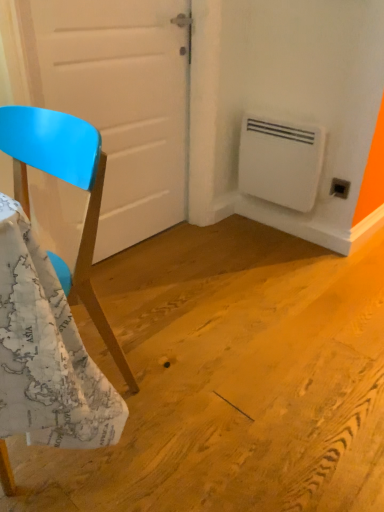
Question: Is matte blue chair at left wider or thinner than white plastic air conditioning unit at lower right?

Choices:
 (A) wide
 (B) thin

Answer: (A)

Question: From a real-world perspective, is matte blue chair at left positioned above or below white plastic air conditioning unit at lower right?

Choices:
 (A) above
 (B) below

Answer: (A)

Question: Which of these objects is positioned closest to the white plastic air conditioning unit at lower right?

Choices:
 (A) white matte door at center
 (B) black plastic electric outlet at lower right
 (C) matte blue chair at left

Answer: (B)

Question: Considering the real-world distances, which object is closest to the black plastic electric outlet at lower right?

Choices:
 (A) white matte door at center
 (B) matte blue chair at left
 (C) white plastic air conditioning unit at lower right

Answer: (C)